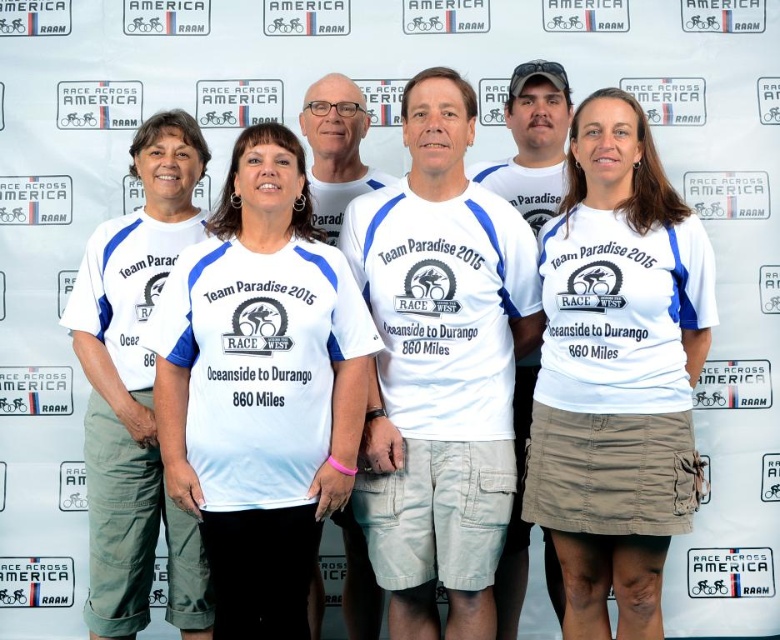
Question: Which object is positioned farthest from the white matte t-shirt at center?

Choices:
 (A) white cotton t-shirt at center
 (B) white cotton shirt at center

Answer: (B)

Question: Which object is farther from the camera taking this photo?

Choices:
 (A) white fabric shirt at center
 (B) white cotton t-shirt at center

Answer: (B)

Question: Can you confirm if white cotton shirt at center is positioned above white matte t-shirt at center?

Choices:
 (A) yes
 (B) no

Answer: (B)

Question: Can you confirm if white fabric shirt at center is bigger than white cotton shirt at center?

Choices:
 (A) no
 (B) yes

Answer: (A)

Question: Considering the relative positions of white fabric shirt at center and white matte t-shirt at center in the image provided, where is white fabric shirt at center located with respect to white matte t-shirt at center?

Choices:
 (A) left
 (B) right

Answer: (A)

Question: Which object is farther from the camera taking this photo?

Choices:
 (A) white cotton t-shirt at center
 (B) white cotton shirt at center

Answer: (A)